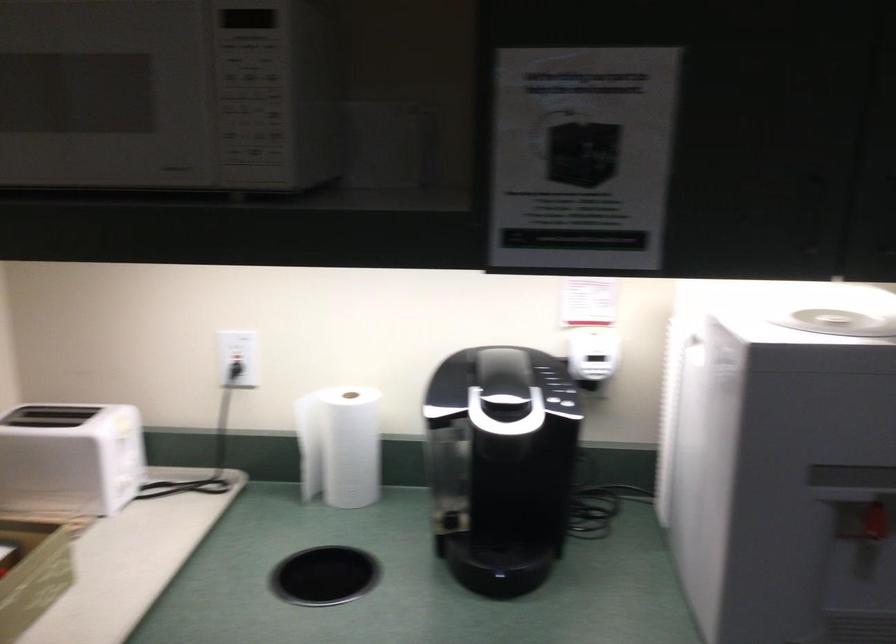
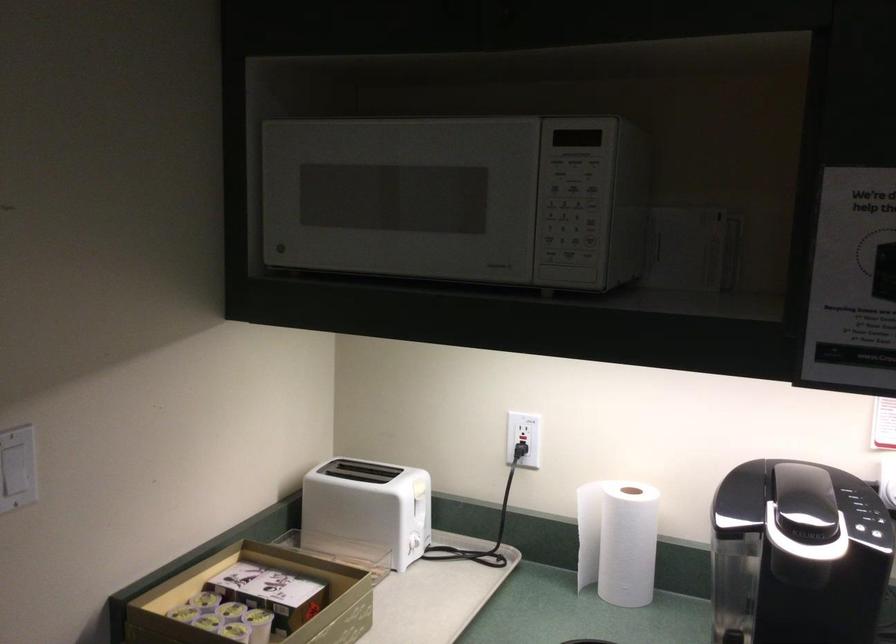
The point at (340, 447) is marked in the first image. Where is the corresponding point in the second image?

(617, 540)